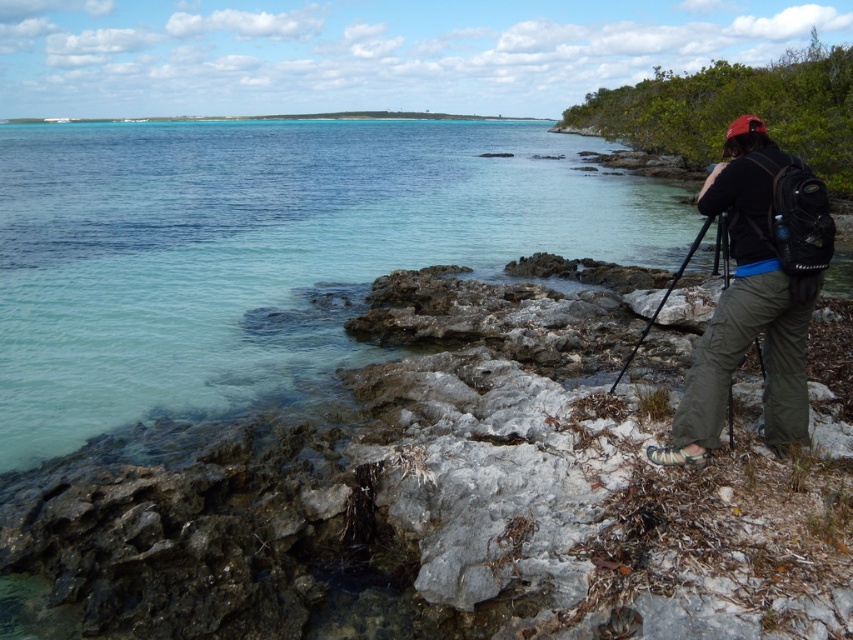
You are standing on the rugged, rocky terrain in the foreground of this coastal scene. You notice the clear water at center and the dark gray pants at right. Which object is closer to you?

Result: The dark gray pants at right are closer to you since the clear water at center is further away.

You are a photographer trying to set up your equipment on the rocky terrain. You have the black matte tripod at right and want to place it near the clear water at center. Based on the scene, can you determine if there is enough space between them for the tripod to be placed securely?

The clear water at center might be wider than black matte tripod at right, so there could be sufficient space for the tripod to be placed securely near the clear water at center.

You are a photographer setting up a tripod on the rocky shore. You have the black matte tripod at right and want to place it so it doesn not fall into the water. The clear water at center is nearby. Based on their sizes, which object takes up more space in the scene?

The clear water at center takes up more space in the scene than the black matte tripod at right because it is larger in size.